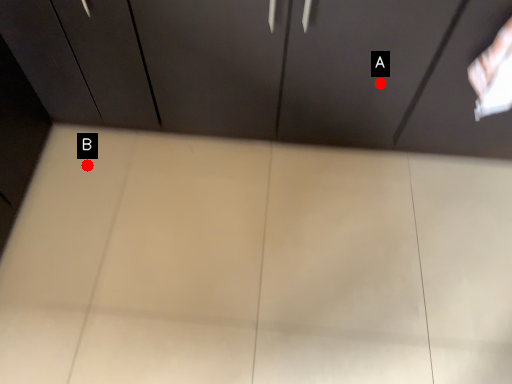
Question: Two points are circled on the image, labeled by A and B beside each circle. Which point is closer to the camera?

Choices:
 (A) A is closer
 (B) B is closer

Answer: (A)